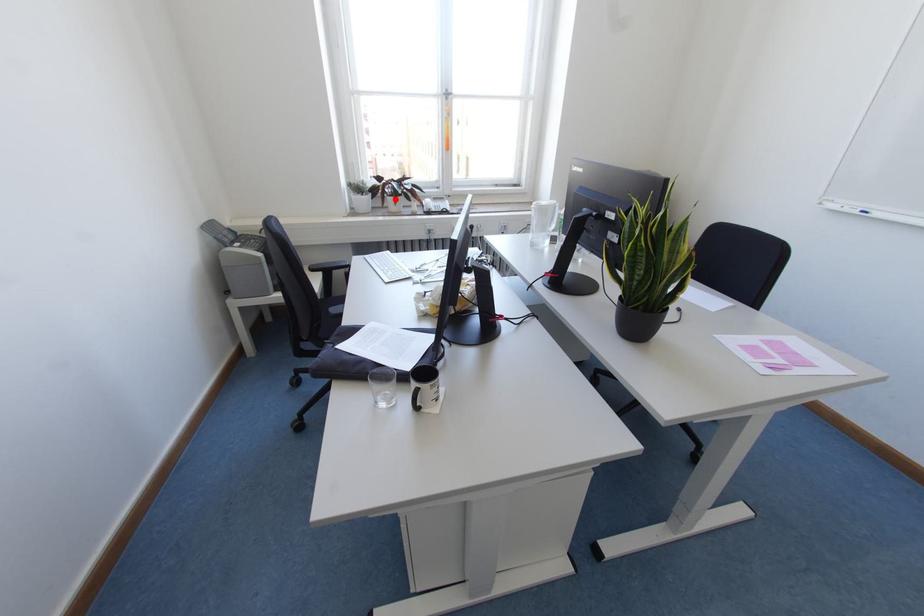
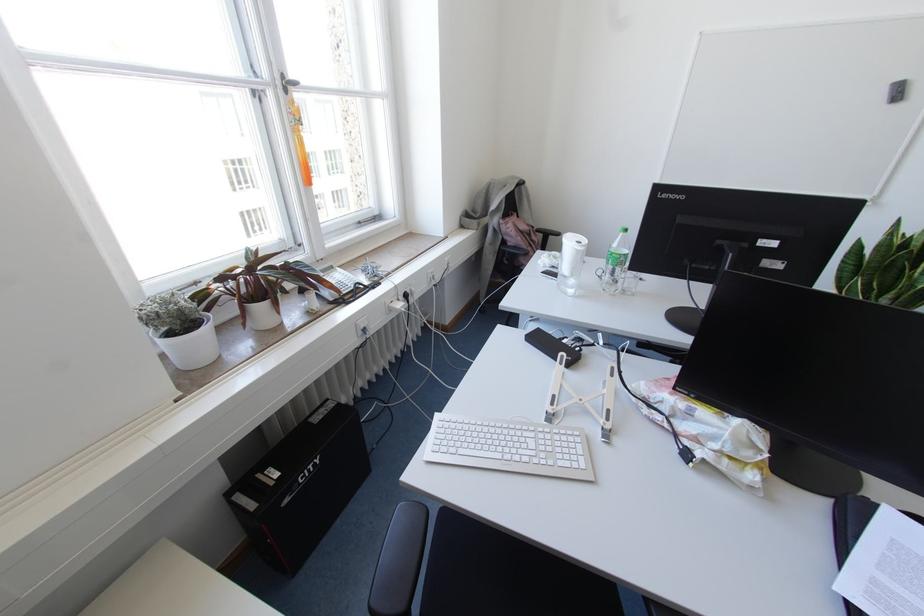
Question: I am providing you with two images of the same scene from different viewpoints. In image1, a red point is highlighted. Considering the same 3D point in image2, which of the following is correct?

Choices:
 (A) It is closer
 (B) It is farther

Answer: (B)